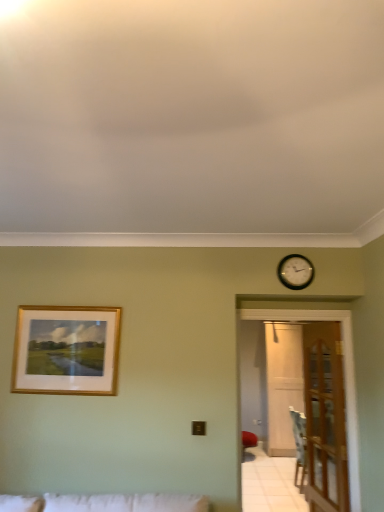
Question: From the image's perspective, is transparent wooden door at right, positioned as the 1th glass door in right-to-left order, above or below clear glass door at right, which is counted as the 1th glass door, starting from the left?

Choices:
 (A) below
 (B) above

Answer: (A)

Question: From a real-world perspective, is transparent wooden door at right, marked as the first glass door in a back-to-front arrangement, positioned above or below clear glass door at right, the 1th glass door when ordered from front to back?

Choices:
 (A) above
 (B) below

Answer: (B)

Question: Which of these objects is positioned farthest from the transparent wooden door at right, marked as the first glass door in a back-to-front arrangement?

Choices:
 (A) clear glass door at right, arranged as the 2th glass door when viewed from the back
 (B) black wooden clock at upper right
 (C) gold-framed picture at upper left
 (D) wooden at right

Answer: (C)

Question: Which object is positioned closest to the clear glass door at right, which is counted as the 1th glass door, starting from the left?

Choices:
 (A) transparent wooden door at right, marked as the first glass door in a back-to-front arrangement
 (B) wooden at right
 (C) gold-framed picture at upper left
 (D) black wooden clock at upper right

Answer: (B)